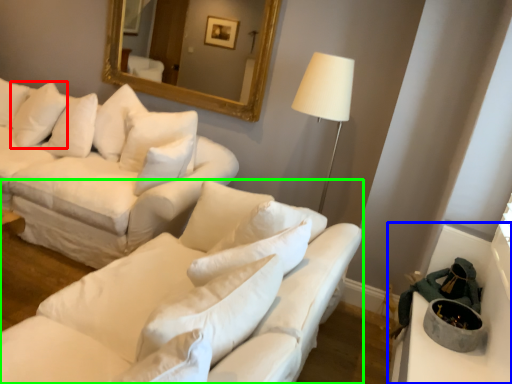
Question: Which object is positioned farthest from pillow (highlighted by a red box)? Select from table (highlighted by a blue box) and studio couch (highlighted by a green box).

Choices:
 (A) table
 (B) studio couch

Answer: (A)